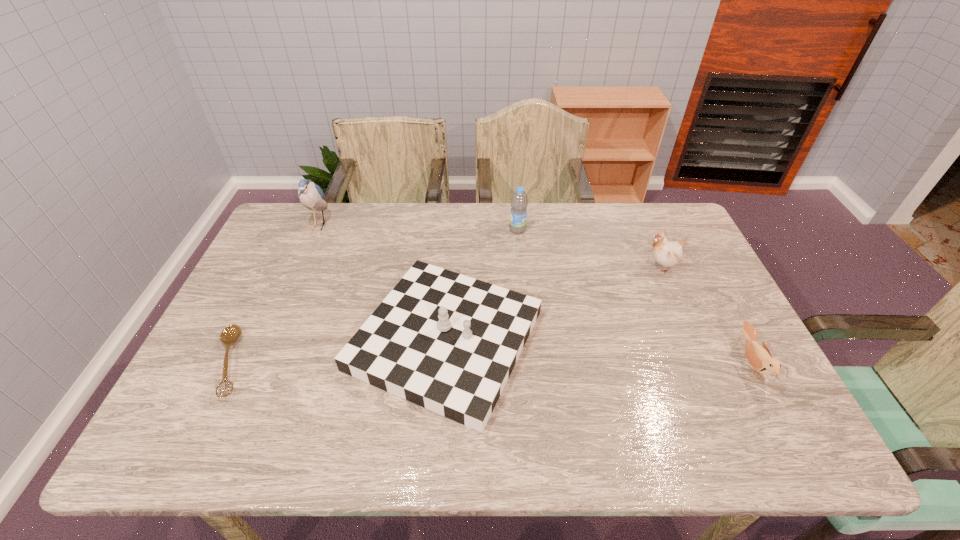
Locate an element on the screen. This screenshot has height=540, width=960. water bottle located at the far edge is located at coordinates (519, 202).

Where is `object located at the near edge`? This screenshot has height=540, width=960. object located at the near edge is located at coordinates coord(444,341).

At what (x,y) coordinates should I click in order to perform the action: click on bird that is positioned at the left edge. Please return your answer as a coordinate pair (x, y). This screenshot has width=960, height=540. Looking at the image, I should click on (311, 195).

At what (x,y) coordinates should I click in order to perform the action: click on ladle located at the left edge. Please return your answer as a coordinate pair (x, y). The image size is (960, 540). Looking at the image, I should click on (231, 333).

At what (x,y) coordinates should I click in order to perform the action: click on object located in the far left corner section of the desktop. Please return your answer as a coordinate pair (x, y). The width and height of the screenshot is (960, 540). Looking at the image, I should click on (311, 195).

What are the coordinates of `vacant space at the far edge of the desktop` in the screenshot? It's located at (462, 232).

Identify the location of vacant space at the near edge of the desktop. (488, 432).

Where is `vacant area at the left edge of the desktop`? The height and width of the screenshot is (540, 960). vacant area at the left edge of the desktop is located at coordinates (296, 247).

Locate an element on the screen. Image resolution: width=960 pixels, height=540 pixels. blank space at the right edge of the desktop is located at coordinates (713, 357).

Locate an element on the screen. This screenshot has width=960, height=540. vacant space at the far left corner of the desktop is located at coordinates (327, 212).